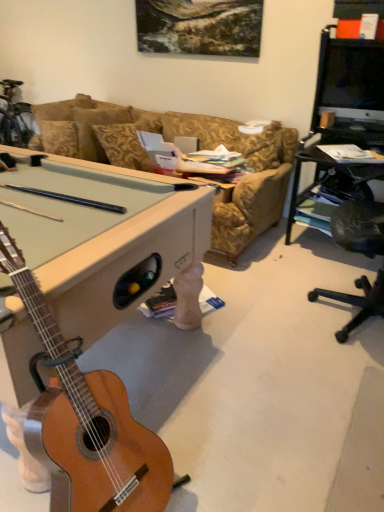
Identify the location of free location to the right of natural wood guitar at lower left. (239, 467).